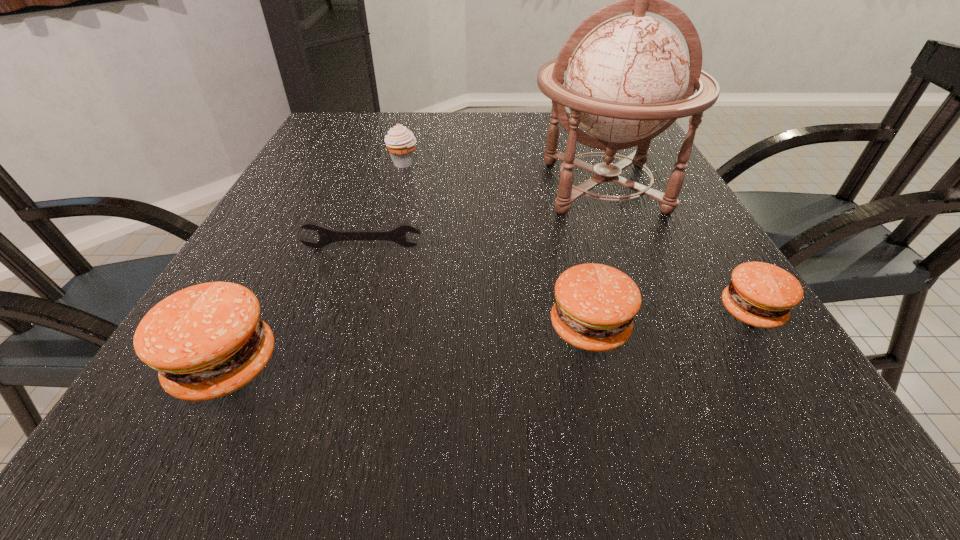
At what (x,y) coordinates should I click in order to perform the action: click on vacant region located 0.090m on the left of the fifth tallest object. Please return your answer as a coordinate pair (x, y). The width and height of the screenshot is (960, 540). Looking at the image, I should click on (665, 312).

Find the location of a particular element. The image size is (960, 540). vacant space located 0.070m on the front of the muffin is located at coordinates (397, 186).

Image resolution: width=960 pixels, height=540 pixels. Identify the location of free space located on the open ends of the fourth nearest object. (344, 308).

Locate an element on the screen. The image size is (960, 540). free space located 0.100m on the front-facing side of the tallest object is located at coordinates (634, 261).

Locate an element on the screen. Image resolution: width=960 pixels, height=540 pixels. patty located at the left edge is located at coordinates (206, 341).

Image resolution: width=960 pixels, height=540 pixels. In order to click on wrench located at the left edge in this screenshot , I will do `click(327, 236)`.

At what (x,y) coordinates should I click in order to perform the action: click on patty that is at the right edge. Please return your answer as a coordinate pair (x, y). The height and width of the screenshot is (540, 960). Looking at the image, I should click on (762, 295).

Where is `globe present at the right edge`? globe present at the right edge is located at coordinates (629, 79).

At what (x,y) coordinates should I click in order to perform the action: click on object that is at the near left corner. Please return your answer as a coordinate pair (x, y). Image resolution: width=960 pixels, height=540 pixels. Looking at the image, I should click on (206, 341).

The height and width of the screenshot is (540, 960). I want to click on object located at the near right corner, so click(762, 295).